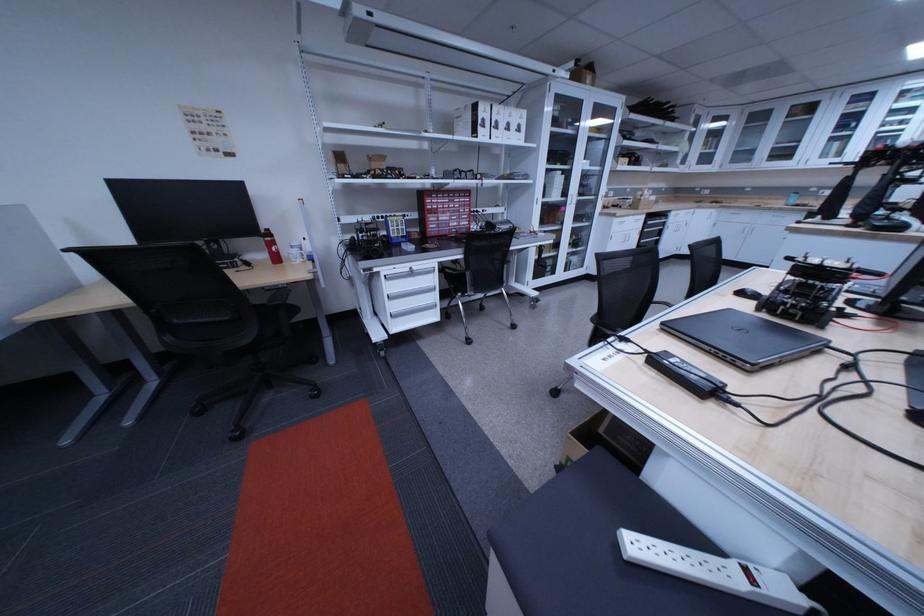
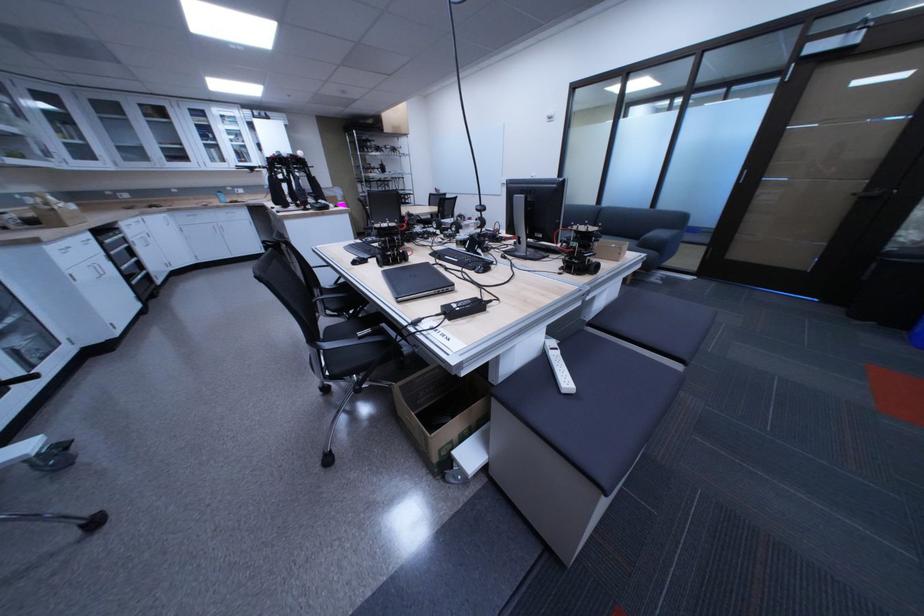
How did the camera likely rotate?

The camera's rotation is toward right-down.